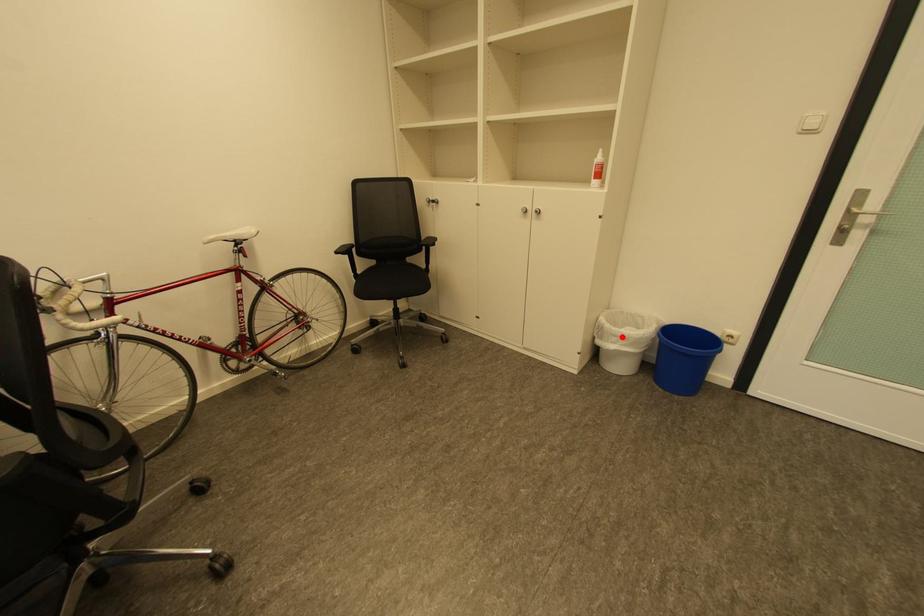
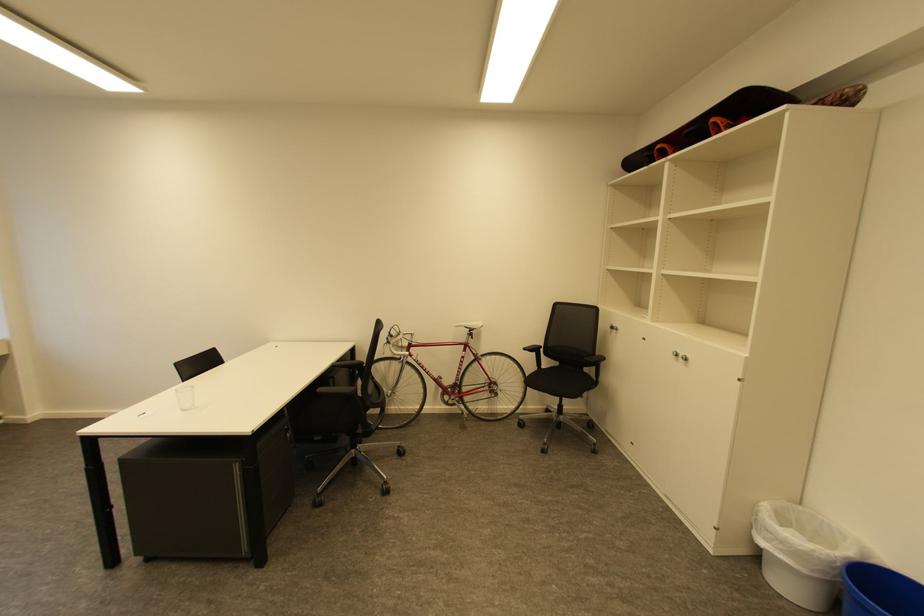
Where in the second image is the point corresponding to the highlighted location from the first image?

(775, 533)